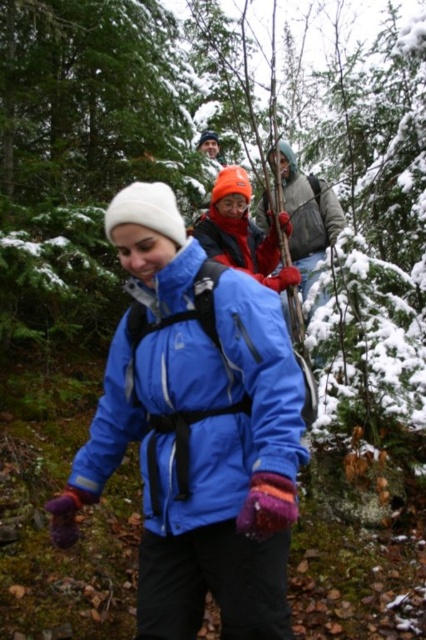
Does blue synthetic jacket at center appear under red fleece jacket at center?

Yes.

Does blue synthetic jacket at center have a larger size compared to red fleece jacket at center?

Indeed, blue synthetic jacket at center has a larger size compared to red fleece jacket at center.

Which is behind, point (239, 355) or point (259, 252)?

Point (259, 252)

At what (x,y) coordinates should I click in order to perform the action: click on blue synthetic jacket at center. Please return your answer as a coordinate pair (x, y). Looking at the image, I should click on (201, 401).

Who is more forward, (285, 164) or (218, 225)?

Point (218, 225) is in front.

Does point (325, 221) lie in front of point (241, 234)?

No, it is behind (241, 234).

The width and height of the screenshot is (426, 640). I want to click on gray fleece jacket at center, so click(x=307, y=209).

Can you confirm if blue synthetic jacket at center is positioned above gray fleece jacket at center?

No, blue synthetic jacket at center is not above gray fleece jacket at center.

Does point (143, 465) come farther from viewer compared to point (264, 208)?

No.

Find the location of `blue synthetic jacket at center`. blue synthetic jacket at center is located at coordinates (201, 401).